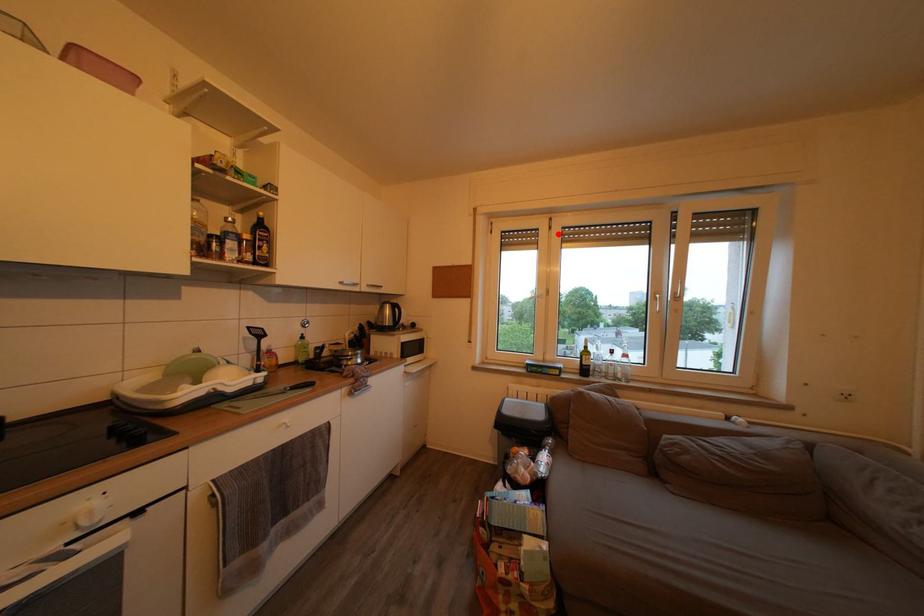
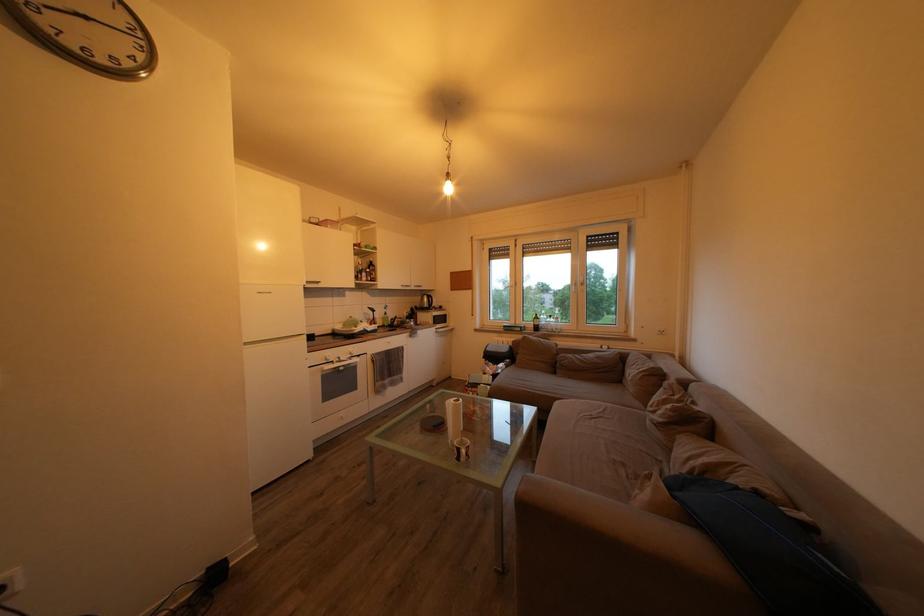
Find the pixel in the second image that matches the highlighted location in the first image.

(524, 252)